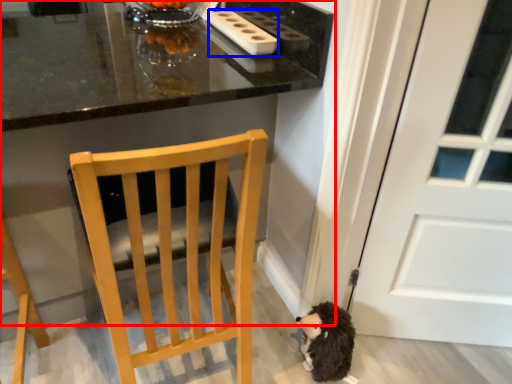
Question: Which object is closer to the camera taking this photo, table (highlighted by a red box) or appliance (highlighted by a blue box)?

Choices:
 (A) table
 (B) appliance

Answer: (A)